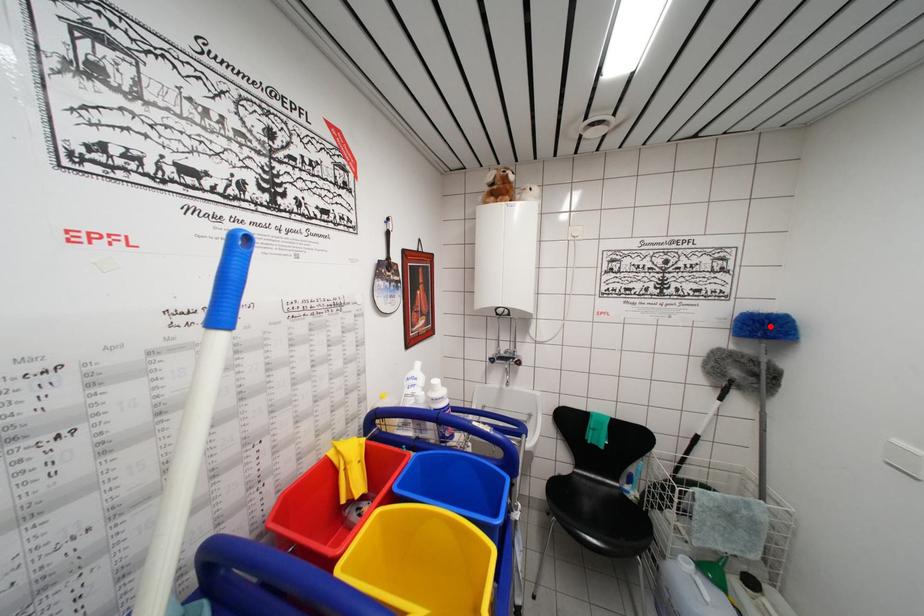
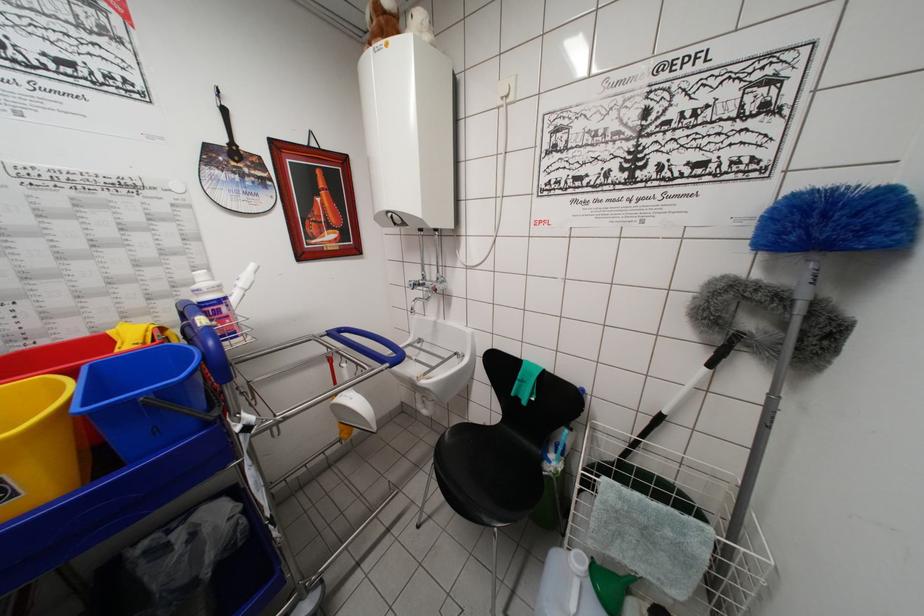
Locate, in the second image, the point that corresponds to the highlighted location in the first image.

(821, 209)